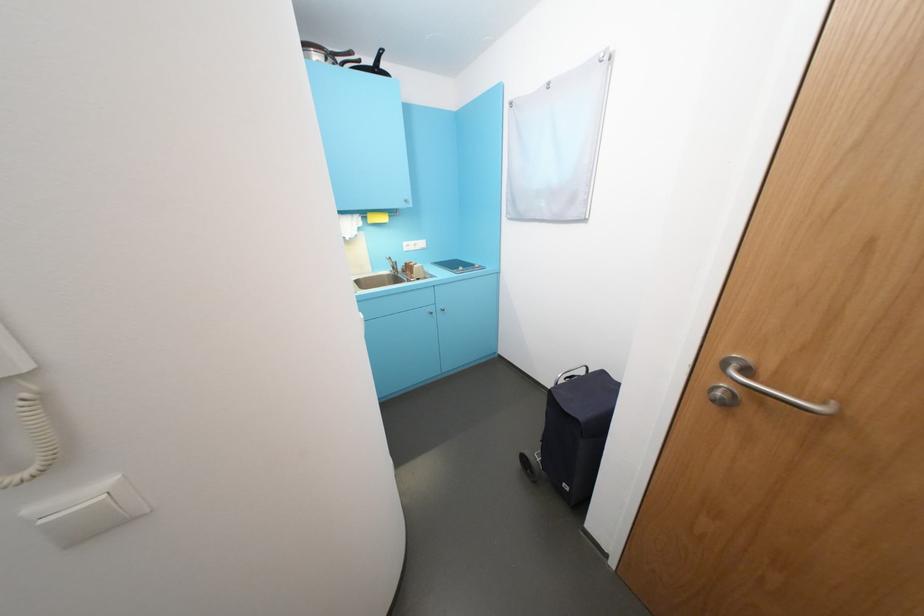
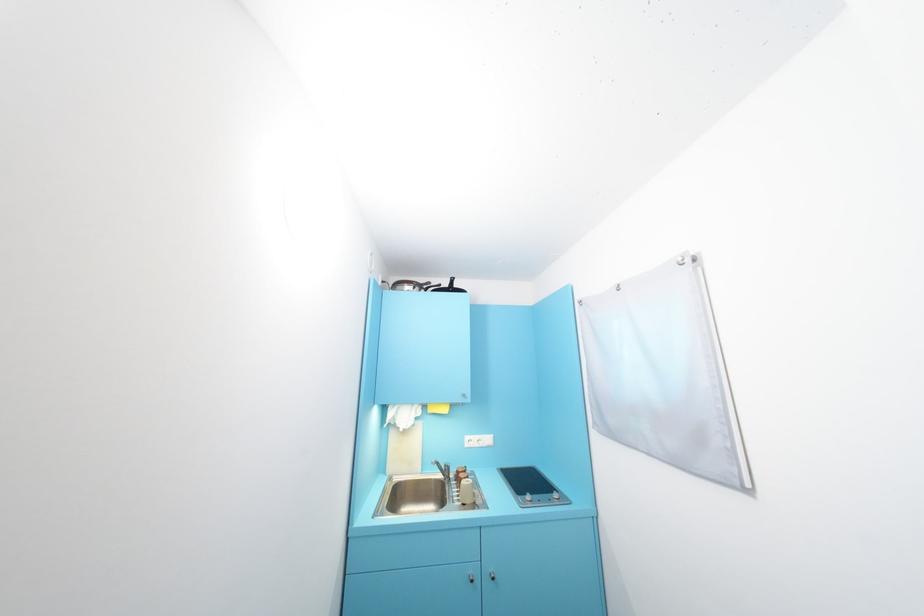
Where in the second image is the point corresponding to point (480, 268) from the first image?

(557, 496)